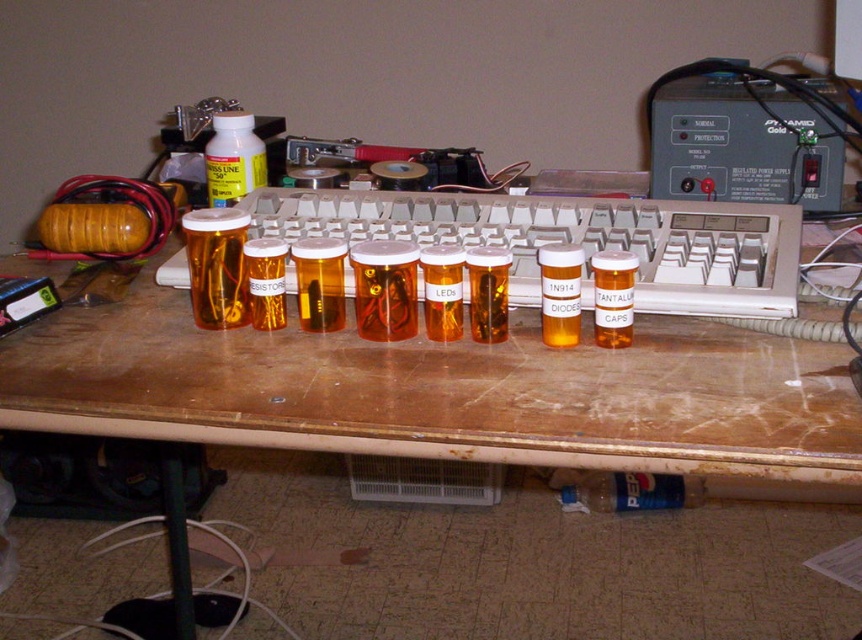
Based on the photo, you are standing at the point marked as point [531,244] in the image. You want to pick up the power supply unit labeled PYRAMID Gold without moving your feet. Can you reach it?

The point [531,244] is 28.39 inches away from the camera. Since the power supply unit labeled PYRAMID Gold is within that distance, you can reach it without moving your feet.

You are organizing a workspace and need to place a new item on the table. The table has a coordinate system where the bottom left corner is the origin. You want to place the item at the point marked by the coordinates point (746, 136). What object is located at that point?

The point (746, 136) marks the location of the black plastic power supply at upper right.

You are setting up a desk and need to place both the white plastic keyboard at center and the orange matte resistor at center on the same shelf. The shelf has a height limit of 10 cm. If the keyboard is 8 cm tall, will both items fit?

The white plastic keyboard at center is taller than the orange matte resistor at center. Since the keyboard is 8 cm tall and the shelf has a 10 cm height limit, both items will fit as their combined height is 8 cm plus the resistor height, which is less than 10 cm.